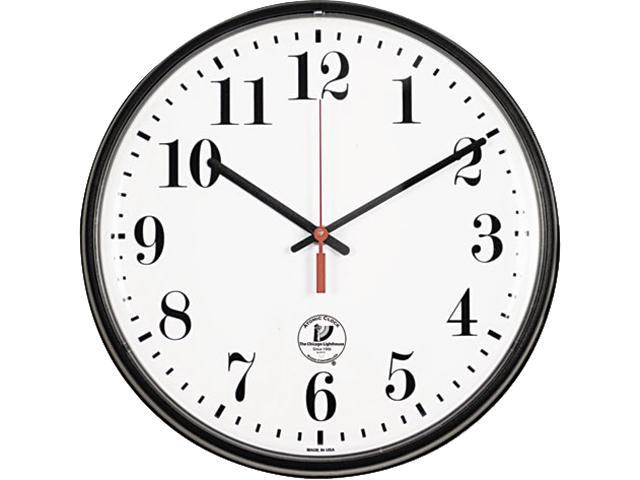
Where is `clock`? The image size is (640, 480). clock is located at coordinates (313, 187).